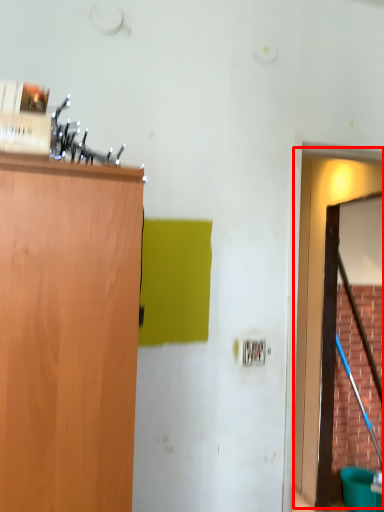
Question: Considering the relative positions of door (annotated by the red box) and plywood in the image provided, where is door (annotated by the red box) located with respect to the staircase?

Choices:
 (A) left
 (B) right

Answer: (A)